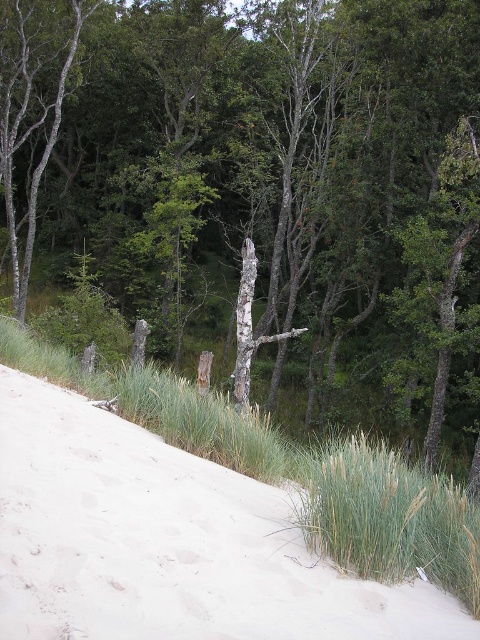
Looking at this image, you are standing at the point marked by the coordinates point (296,472) in the image. Looking around, you see the sandy dune on the left and the green vegetation on the right. Which direction should you walk to reach the sandy dune?

To reach the sandy dune on the left, you should walk towards the left from the point (296,472), as the dune is located to the left side of the image.

You are a hiker trying to cross a sandy dune on the left. You see the green grass at lower left and the gray bark tree trunk at center. Which one is wider?

The green grass at lower left is wider than the gray bark tree trunk at center.